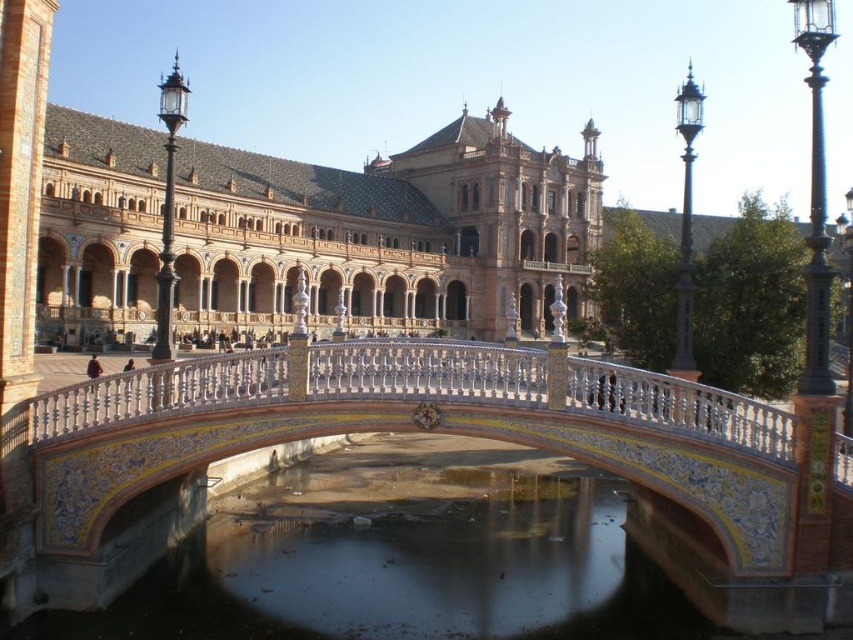
Who is lower down, smooth concrete river at center or decorative ceramic bridge at center?

Positioned lower is smooth concrete river at center.

Who is positioned more to the right, smooth concrete river at center or decorative ceramic bridge at center?

From the viewer's perspective, decorative ceramic bridge at center appears more on the right side.

Is point (548, 545) more distant than point (238, 364)?

Yes, point (548, 545) is farther from viewer.

Locate an element on the screen. smooth concrete river at center is located at coordinates (403, 556).